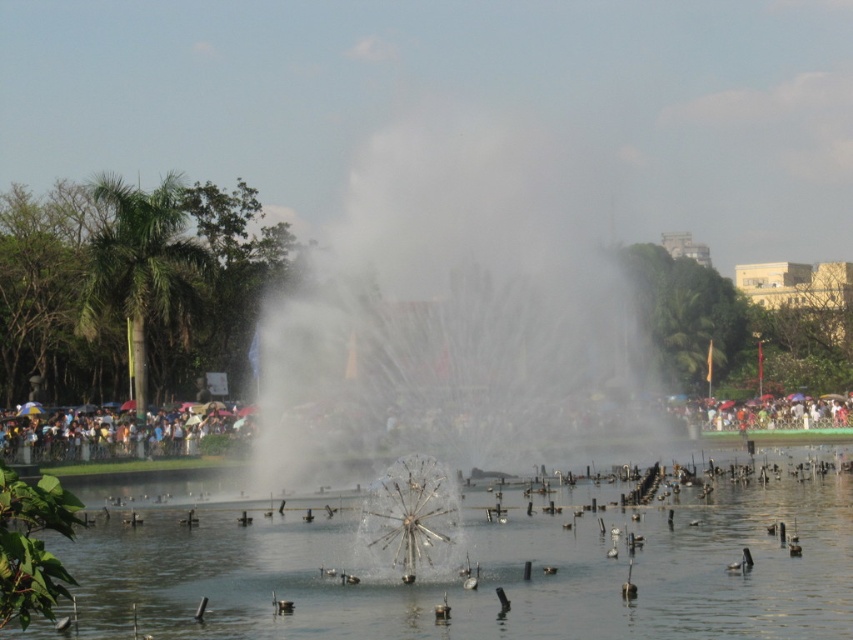
You are a photographer planning to capture the clear water at center and the matte black crowd at center in a single shot. Based on their sizes, which object should you focus on to ensure both are in frame without cropping?

Since the clear water at center is smaller than the matte black crowd at center, you should focus on the clear water at center to ensure both are in frame without cropping.

You are standing at the edge of the fountain and see the matte black crowd at center and the brown fuzzy duck at center. Which object is closer to your right side?

The brown fuzzy duck at center is closer to your right side because the matte black crowd at center is to the left of it.